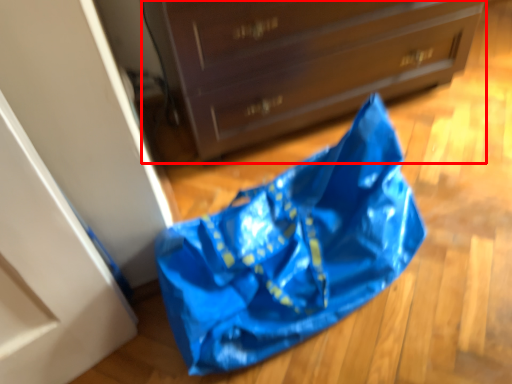
Question: From the image, what is the correct spatial relationship of chest of drawers (annotated by the red box) in relation to grocery bag?

Choices:
 (A) left
 (B) right

Answer: (B)